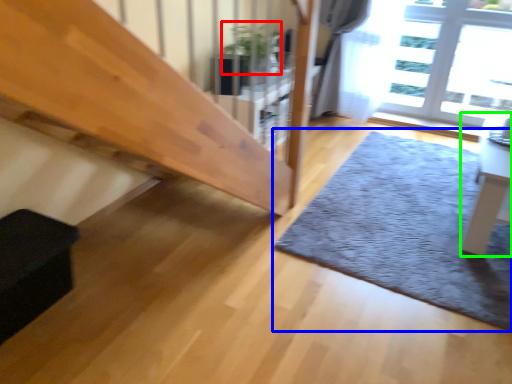
Question: Which is farther away from plant (highlighted by a red box)? mat (highlighted by a blue box) or table (highlighted by a green box)?

Choices:
 (A) mat
 (B) table

Answer: (B)